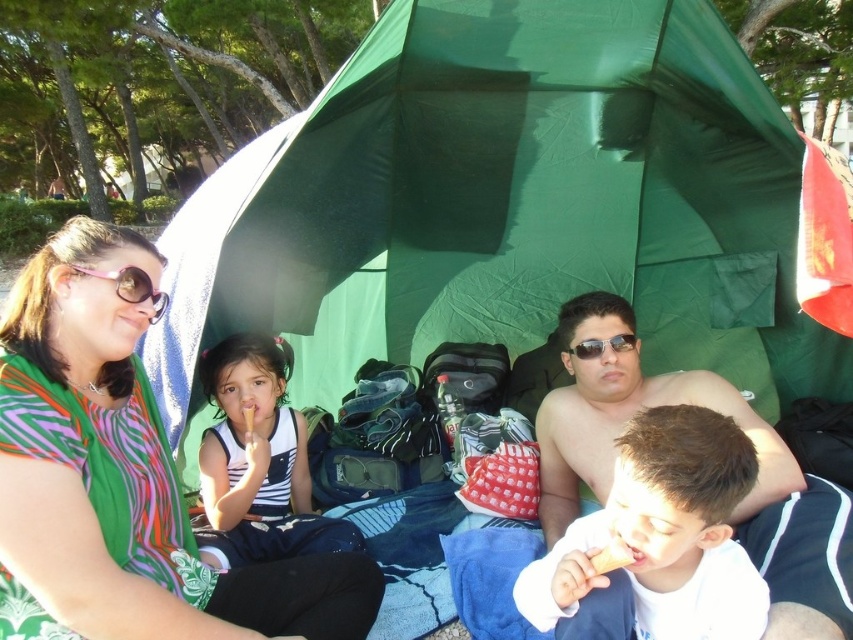
Question: Does white cotton shirt at lower right come in front of shiny metallic man at center?

Choices:
 (A) no
 (B) yes

Answer: (B)

Question: Which object is closer to the camera taking this photo?

Choices:
 (A) white cotton shirt at lower right
 (B) printed fabric scarf at upper left
 (C) pink plastic goggles at upper left
 (D) shiny metallic man at center

Answer: (B)

Question: Which point is farther to the camera?

Choices:
 (A) green fabric tent at upper center
 (B) striped fabric dress at center
 (C) sunglasses at center
 (D) white cotton shirt at lower right

Answer: (C)

Question: Does printed fabric scarf at upper left have a lesser width compared to sunglasses at center?

Choices:
 (A) no
 (B) yes

Answer: (A)

Question: Which is nearer to the white cotton shirt at lower right?

Choices:
 (A) printed fabric scarf at upper left
 (B) pink plastic goggles at upper left

Answer: (A)

Question: Is shiny metallic man at center bigger than sunglasses at center?

Choices:
 (A) no
 (B) yes

Answer: (B)